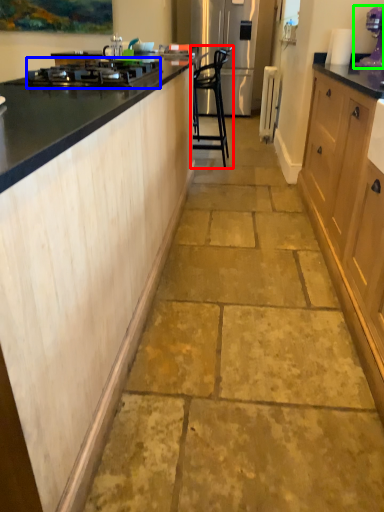
Question: Considering the real-world distances, which object is closest to chair (highlighted by a red box)? home appliance (highlighted by a blue box) or kitchen appliance (highlighted by a green box).

Choices:
 (A) home appliance
 (B) kitchen appliance

Answer: (B)